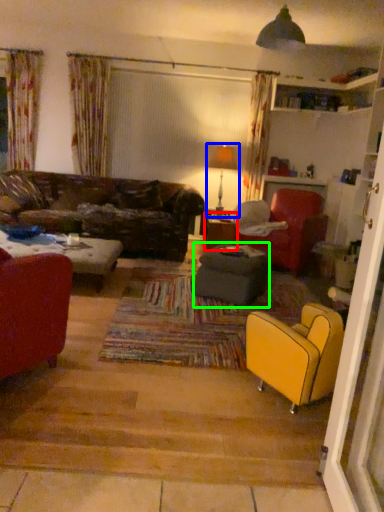
Question: Based on their relative distances, which object is farther from table (highlighted by a red box)? Choose from lamp (highlighted by a blue box) and footrest (highlighted by a green box).

Choices:
 (A) lamp
 (B) footrest

Answer: (B)